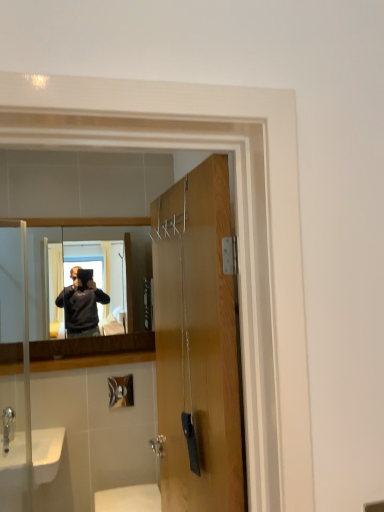
The width and height of the screenshot is (384, 512). I want to click on white glossy sink at lower left, so click(x=13, y=474).

At what (x,y) coordinates should I click in order to perform the action: click on white glossy toilet at lower center. Please return your answer as a coordinate pair (x, y). Looking at the image, I should click on (129, 499).

From the image's perspective, which one is positioned lower, wooden door at center or silver metallic faucet at lower left?

From the image's view, silver metallic faucet at lower left is below.

Between wooden door at center and silver metallic faucet at lower left, which one has less height?

silver metallic faucet at lower left is shorter.

Is the position of wooden door at center less distant than that of silver metallic faucet at lower left?

Yes, it is in front of silver metallic faucet at lower left.

Is silver metallic faucet at lower left completely or partially outside of wooden door at center?

Yes, silver metallic faucet at lower left is not within wooden door at center.

Is silver metallic faucet at lower left touching wooden door at center?

silver metallic faucet at lower left and wooden door at center are not in contact.

Considering the sizes of objects silver metallic faucet at lower left and wooden door at center in the image provided, who is shorter, silver metallic faucet at lower left or wooden door at center?

Standing shorter between the two is silver metallic faucet at lower left.

Considering the points (14, 424) and (226, 314), which point is behind, point (14, 424) or point (226, 314)?

The point (14, 424) is behind.

Does wooden door at center have a smaller size compared to white glossy sink at lower left?

Incorrect, wooden door at center is not smaller in size than white glossy sink at lower left.

From a real-world perspective, which is physically above, wooden door at center or white glossy sink at lower left?

wooden door at center.

Considering the sizes of objects wooden door at center and white glossy sink at lower left in the image provided, who is taller, wooden door at center or white glossy sink at lower left?

wooden door at center is taller.

Considering the sizes of objects wooden door at center and white glossy toilet at lower center in the image provided, who is thinner, wooden door at center or white glossy toilet at lower center?

Thinner between the two is wooden door at center.

Where is `door on the right of white glossy toilet at lower center`? door on the right of white glossy toilet at lower center is located at coordinates (197, 342).

What's the angular difference between wooden door at center and white glossy toilet at lower center's facing directions?

87.5 degrees.

Is point (166, 252) positioned in front of point (155, 511)?

Yes, point (166, 252) is closer to viewer.

Does white glossy toilet at lower center have a smaller size compared to wooden door at center?

Yes.

Based on the photo, is white glossy toilet at lower center turned away from wooden door at center?

No, white glossy toilet at lower center's orientation is not away from wooden door at center.

Is white glossy toilet at lower center to the right of wooden door at center from the viewer's perspective?

Incorrect, white glossy toilet at lower center is not on the right side of wooden door at center.

Is white glossy toilet at lower center beside wooden door at center?

No, white glossy toilet at lower center is not with wooden door at center.

Considering their positions, is matte wooden mirror at center located in front of or behind silver metallic faucet at lower left?

In the image, matte wooden mirror at center appears behind silver metallic faucet at lower left.

Would you say matte wooden mirror at center is to the left or to the right of silver metallic faucet at lower left in the picture?

matte wooden mirror at center is to the right of silver metallic faucet at lower left.

From a real-world perspective, is matte wooden mirror at center physically located above or below silver metallic faucet at lower left?

matte wooden mirror at center is situated higher than silver metallic faucet at lower left in the real world.

From the picture: Considering the relative sizes of matte wooden mirror at center and silver metallic faucet at lower left in the image provided, is matte wooden mirror at center thinner than silver metallic faucet at lower left?

Correct, the width of matte wooden mirror at center is less than that of silver metallic faucet at lower left.

Is white glossy sink at lower left taller or shorter than wooden door at center?

In the image, white glossy sink at lower left appears to be shorter than wooden door at center.

Is white glossy sink at lower left wider than wooden door at center?

Yes, white glossy sink at lower left is wider than wooden door at center.

Is point (43, 454) farther from camera compared to point (223, 488)?

Yes, it is.

From the image's perspective, is white glossy sink at lower left on wooden door at center?

No, from the image's perspective, white glossy sink at lower left is not over wooden door at center.

Where is `faucet that appears below the wooden door at center (from a real-world perspective)`? faucet that appears below the wooden door at center (from a real-world perspective) is located at coordinates (8, 426).

Find the location of a particular element. This screenshot has height=512, width=384. faucet below the wooden door at center (from the image's perspective) is located at coordinates (8, 426).

Estimate the real-world distances between objects in this image. Which object is further from silver metallic faucet at lower left, matte wooden mirror at center or white glossy toilet at lower center?

matte wooden mirror at center.

From the image, which object appears to be farther from white glossy toilet at lower center, silver metallic faucet at lower left or matte wooden mirror at center?

matte wooden mirror at center is further to white glossy toilet at lower center.

From the image, which object appears to be farther from silver metallic faucet at lower left, white glossy sink at lower left or wooden door at center?

wooden door at center is further to silver metallic faucet at lower left.

From the image, which object appears to be farther from white glossy sink at lower left, matte wooden mirror at center or wooden door at center?

wooden door at center lies further to white glossy sink at lower left than the other object.

From the image, which object appears to be nearer to silver metallic faucet at lower left, wooden door at center or white glossy toilet at lower center?

white glossy toilet at lower center lies closer to silver metallic faucet at lower left than the other object.

Looking at the image, which one is located closer to matte wooden mirror at center, white glossy toilet at lower center or wooden door at center?

Based on the image, white glossy toilet at lower center appears to be nearer to matte wooden mirror at center.

Estimate the real-world distances between objects in this image. Which object is further from wooden door at center, white glossy toilet at lower center or silver metallic faucet at lower left?

white glossy toilet at lower center.

Estimate the real-world distances between objects in this image. Which object is further from white glossy sink at lower left, matte wooden mirror at center or silver metallic faucet at lower left?

The object further to white glossy sink at lower left is matte wooden mirror at center.

This screenshot has width=384, height=512. Find the location of `faucet between wooden door at center and matte wooden mirror at center from front to back`. faucet between wooden door at center and matte wooden mirror at center from front to back is located at coordinates (8, 426).

At what (x,y) coordinates should I click in order to perform the action: click on sink situated between silver metallic faucet at lower left and white glossy toilet at lower center from left to right. Please return your answer as a coordinate pair (x, y). Image resolution: width=384 pixels, height=512 pixels. Looking at the image, I should click on (13, 474).

I want to click on toilet positioned between wooden door at center and matte wooden mirror at center from near to far, so click(129, 499).

You are a GUI agent. You are given a task and a screenshot of the screen. Output one action in this format:
    pyautogui.click(x=<x>, y=<y>)
    Task: Click on the toilet between wooden door at center and silver metallic faucet at lower left from front to back
    
    Given the screenshot: What is the action you would take?
    pyautogui.click(x=129, y=499)